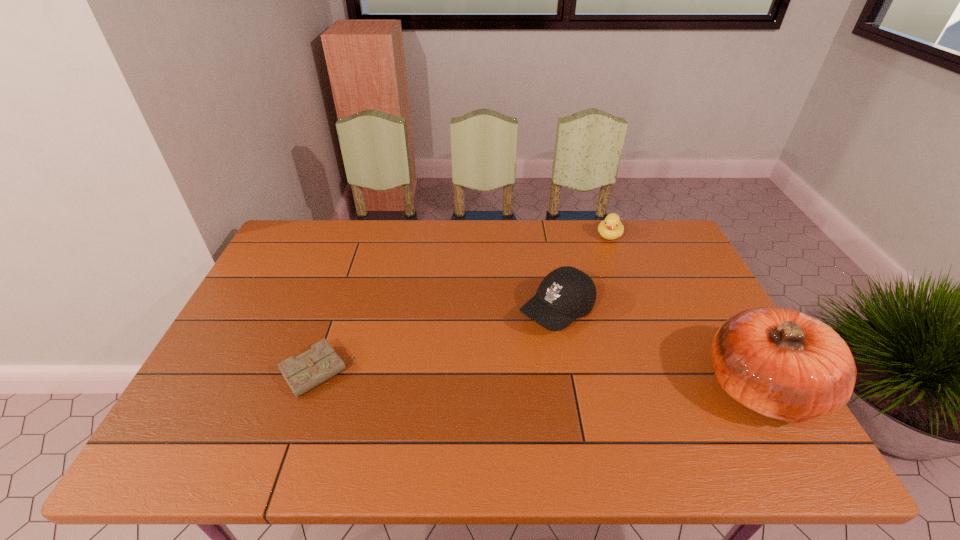
This screenshot has height=540, width=960. I want to click on object located at the near right corner, so click(780, 363).

Where is `free space at the far edge`? This screenshot has height=540, width=960. free space at the far edge is located at coordinates (481, 241).

You are a GUI agent. You are given a task and a screenshot of the screen. Output one action in this format:
    pyautogui.click(x=<x>, y=<y>)
    Task: Click on the free region at the left edge
    
    Given the screenshot: What is the action you would take?
    pyautogui.click(x=268, y=329)

In the image, there is a desktop. Where is `vacant space at the right edge`? This screenshot has width=960, height=540. vacant space at the right edge is located at coordinates (706, 347).

In the image, there is a desktop. At what (x,y) coordinates should I click in order to perform the action: click on vacant space at the far left corner. Please return your answer as a coordinate pair (x, y). The height and width of the screenshot is (540, 960). Looking at the image, I should click on (310, 234).

Find the location of `blank space at the near left corner of the desktop`. blank space at the near left corner of the desktop is located at coordinates (254, 412).

Image resolution: width=960 pixels, height=540 pixels. I want to click on vacant area at the far right corner, so click(671, 244).

Where is `vacant space at the near right corner of the desktop`? vacant space at the near right corner of the desktop is located at coordinates (724, 401).

This screenshot has height=540, width=960. What are the coordinates of `free point between the third object from right to left and the pumpkin` in the screenshot? It's located at (659, 349).

Locate an element on the screen. This screenshot has width=960, height=540. free space between the second object from left to right and the shortest object is located at coordinates (437, 342).